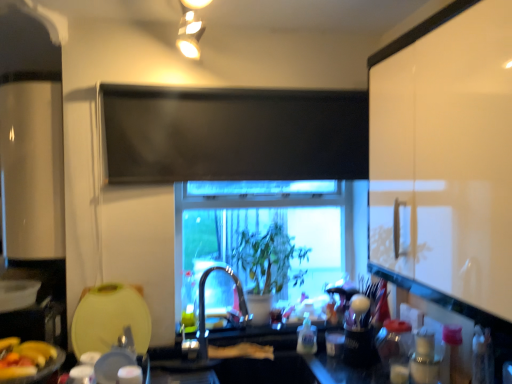
Question: Is green matte plant at center aimed at white glossy cabinet at right?

Choices:
 (A) no
 (B) yes

Answer: (A)

Question: Can you confirm if green matte plant at center is wider than white glossy cabinet at right?

Choices:
 (A) yes
 (B) no

Answer: (B)

Question: Considering the relative sizes of green matte plant at center and white glossy cabinet at right in the image provided, is green matte plant at center shorter than white glossy cabinet at right?

Choices:
 (A) yes
 (B) no

Answer: (A)

Question: From the image's perspective, is green matte plant at center located beneath white glossy cabinet at right?

Choices:
 (A) no
 (B) yes

Answer: (B)

Question: Is green matte plant at center with white glossy cabinet at right?

Choices:
 (A) no
 (B) yes

Answer: (A)

Question: Is the position of green matte plant at center more distant than that of white glossy cabinet at right?

Choices:
 (A) no
 (B) yes

Answer: (B)

Question: Considering the relative sizes of matte plastic toothbrush holder at lower right and transparent glass window at center in the image provided, is matte plastic toothbrush holder at lower right wider than transparent glass window at center?

Choices:
 (A) yes
 (B) no

Answer: (B)

Question: Is transparent glass window at center at the back of matte plastic toothbrush holder at lower right?

Choices:
 (A) yes
 (B) no

Answer: (B)

Question: Is matte plastic toothbrush holder at lower right positioned before transparent glass window at center?

Choices:
 (A) no
 (B) yes

Answer: (B)

Question: Does matte plastic toothbrush holder at lower right appear on the left side of transparent glass window at center?

Choices:
 (A) no
 (B) yes

Answer: (A)

Question: From the image's perspective, does matte plastic toothbrush holder at lower right appear lower than transparent glass window at center?

Choices:
 (A) no
 (B) yes

Answer: (B)

Question: Can you confirm if matte plastic toothbrush holder at lower right is shorter than transparent glass window at center?

Choices:
 (A) no
 (B) yes

Answer: (B)

Question: Can you confirm if transparent glass window at center is positioned to the right of green matte plant at center?

Choices:
 (A) yes
 (B) no

Answer: (A)